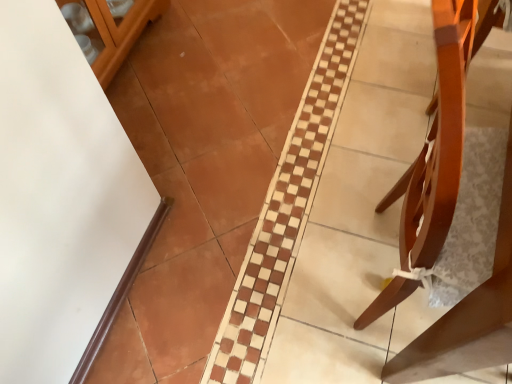
Question: Does light brown wood chair at right have a smaller size compared to white glossy glass door at upper left?

Choices:
 (A) yes
 (B) no

Answer: (B)

Question: Does light brown wood chair at right have a greater height compared to white glossy glass door at upper left?

Choices:
 (A) yes
 (B) no

Answer: (A)

Question: Does light brown wood chair at right have a lesser height compared to white glossy glass door at upper left?

Choices:
 (A) no
 (B) yes

Answer: (A)

Question: From the image's perspective, is light brown wood chair at right on top of white glossy glass door at upper left?

Choices:
 (A) yes
 (B) no

Answer: (B)

Question: Is the surface of light brown wood chair at right in direct contact with white glossy glass door at upper left?

Choices:
 (A) no
 (B) yes

Answer: (A)

Question: Is light brown wood chair at right turned away from white glossy glass door at upper left?

Choices:
 (A) no
 (B) yes

Answer: (A)

Question: From a real-world perspective, is white glossy glass door at upper left beneath light brown wood chair at right?

Choices:
 (A) no
 (B) yes

Answer: (B)

Question: Considering the relative sizes of white glossy glass door at upper left and light brown wood chair at right in the image provided, is white glossy glass door at upper left thinner than light brown wood chair at right?

Choices:
 (A) yes
 (B) no

Answer: (A)

Question: From the image's perspective, is white glossy glass door at upper left located beneath light brown wood chair at right?

Choices:
 (A) yes
 (B) no

Answer: (B)

Question: Is light brown wood chair at right surrounded by white glossy glass door at upper left?

Choices:
 (A) yes
 (B) no

Answer: (B)

Question: Considering the relative sizes of white glossy glass door at upper left and light brown wood chair at right in the image provided, is white glossy glass door at upper left taller than light brown wood chair at right?

Choices:
 (A) no
 (B) yes

Answer: (A)

Question: From a real-world perspective, is white glossy glass door at upper left physically above light brown wood chair at right?

Choices:
 (A) no
 (B) yes

Answer: (A)

Question: From a real-world perspective, relative to light brown wood chair at right, is white glossy glass door at upper left vertically above or below?

Choices:
 (A) above
 (B) below

Answer: (B)